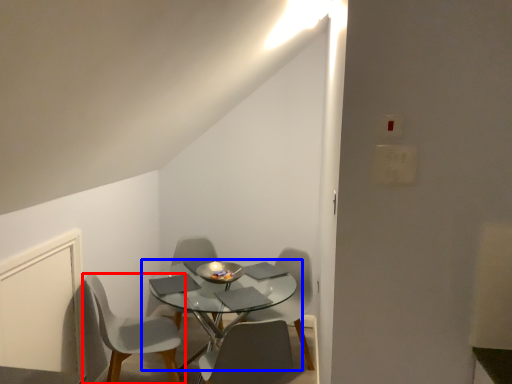
Question: Which object is closer to the camera taking this photo, chair (highlighted by a red box) or coffee table (highlighted by a blue box)?

Choices:
 (A) chair
 (B) coffee table

Answer: (B)